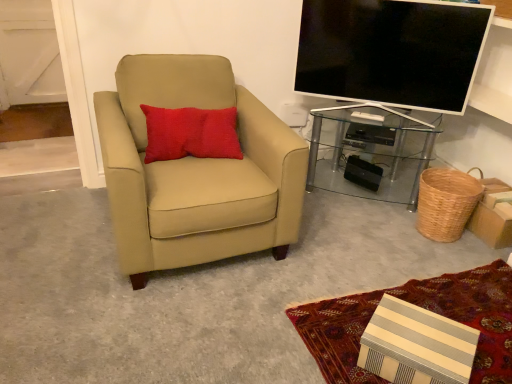
Where is `blank space to the left of beige leather chair at left`? The width and height of the screenshot is (512, 384). blank space to the left of beige leather chair at left is located at coordinates (59, 229).